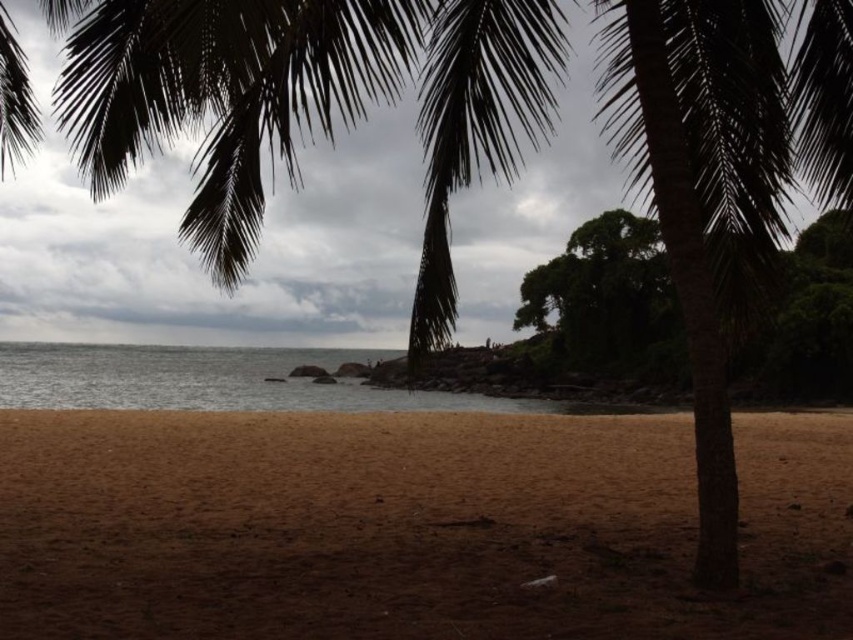
You are standing at the point marked as point (409, 528) on the image. What object are you standing on?

You are standing on the brown sandy beach at lower center, as the brown sandy beach at lower center is located at point (409, 528).

You are standing on the sandy beach in the image and want to walk from the point at coordinates point (99,602) to the point at coordinates point (704,454). Which direction should you face to move towards the second point?

You should face towards the point (704,454), which is behind the point (99,602) based on their spatial relationship in the image.